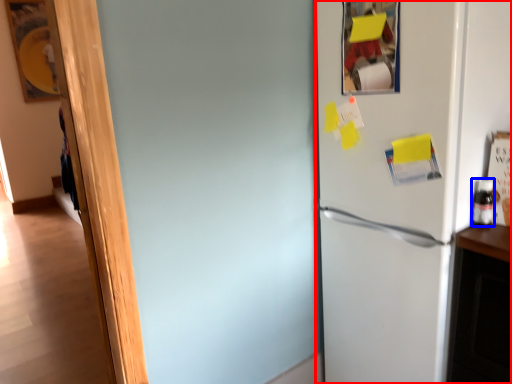
Question: Which of the following is the closest to the observer, refrigerator (highlighted by a red box) or bottle (highlighted by a blue box)?

Choices:
 (A) refrigerator
 (B) bottle

Answer: (A)